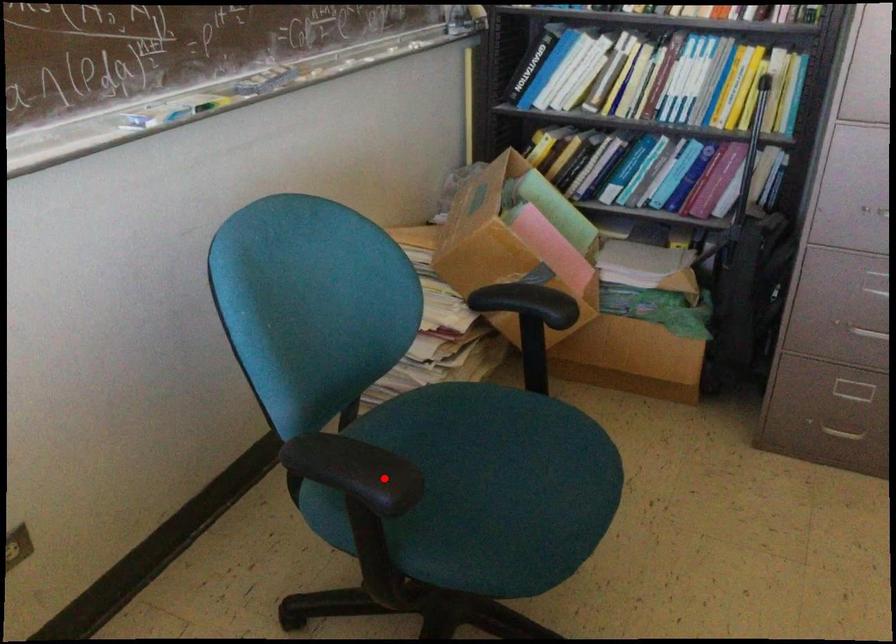
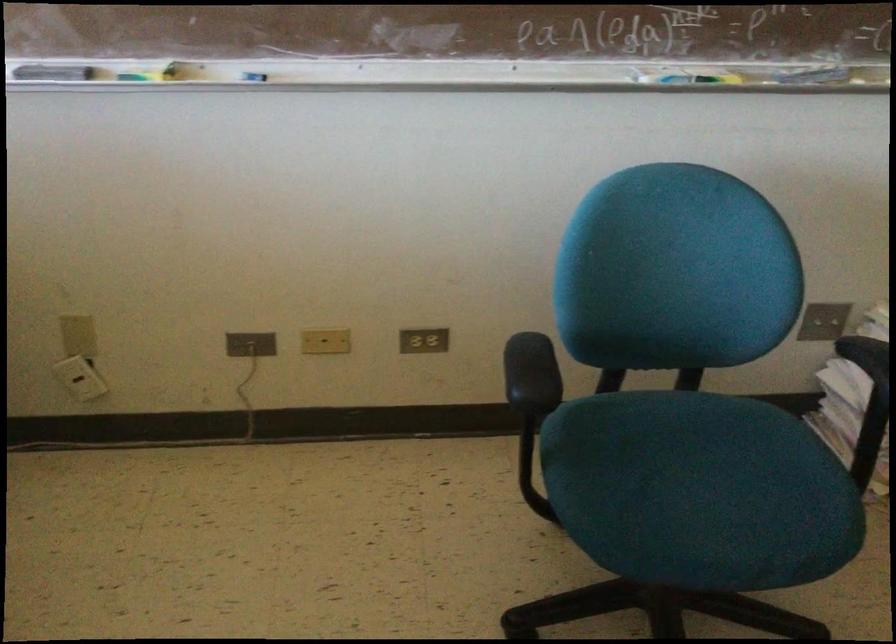
In the second image, find the point that corresponds to the highlighted location in the first image.

(531, 374)